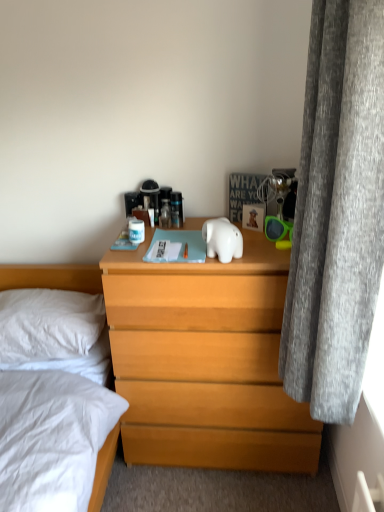
Question: From their relative heights in the image, would you say white glossy elephant at center is taller or shorter than light brown wooden chest of drawers at center?

Choices:
 (A) tall
 (B) short

Answer: (B)

Question: From a real-world perspective, relative to light brown wooden chest of drawers at center, is white glossy elephant at center vertically above or below?

Choices:
 (A) below
 (B) above

Answer: (B)

Question: Based on their relative distances, which object is farther from the light brown wooden chest of drawers at center?

Choices:
 (A) white glossy elephant at center
 (B) clear plastic bottle at center
 (C) gray fabric curtain at right
 (D) white soft pillow at left

Answer: (B)

Question: Estimate the real-world distances between objects in this image. Which object is farther from the gray fabric curtain at right?

Choices:
 (A) white glossy elephant at center
 (B) white soft pillow at left
 (C) light brown wooden chest of drawers at center
 (D) clear plastic bottle at center

Answer: (B)